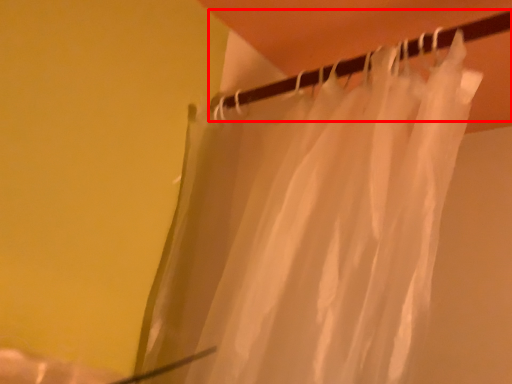
Question: Where is clothesline (annotated by the red box) located in relation to curtain in the image?

Choices:
 (A) left
 (B) right

Answer: (A)